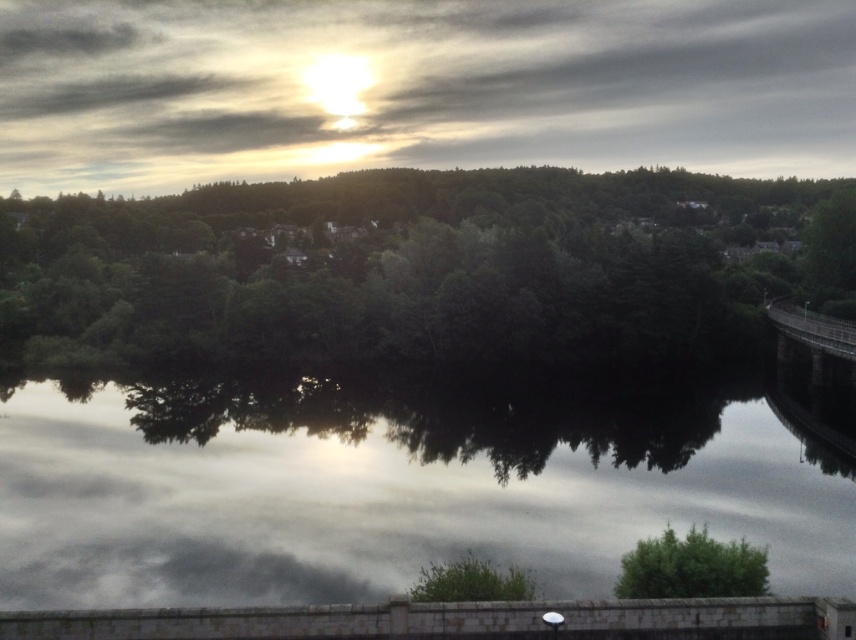
Based on the photo, you are standing in the landscape scene and want to reach a specific location marked by the point at coordinates point (x=401, y=218). If you can walk at a speed of 1.5 meters per second, how many seconds will it take you to reach that point?

The distance between you and the point (x=401, y=218) is 242.51 meters. At a walking speed of 1.5 meters per second, it would take approximately 161.67 seconds to reach the point.

What are the coordinates of the green leafy trees at center?

The green leafy trees at center are located at coordinates point [420,266].